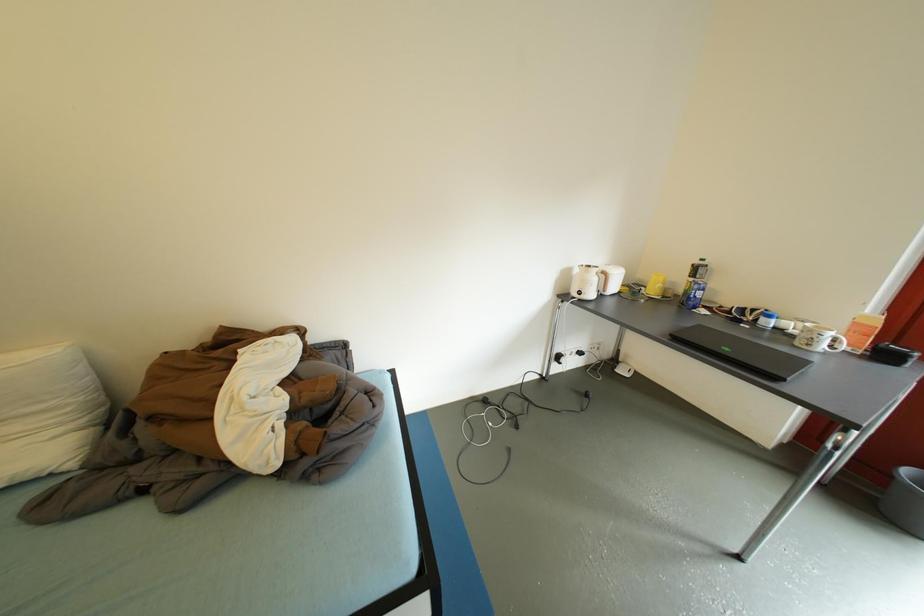
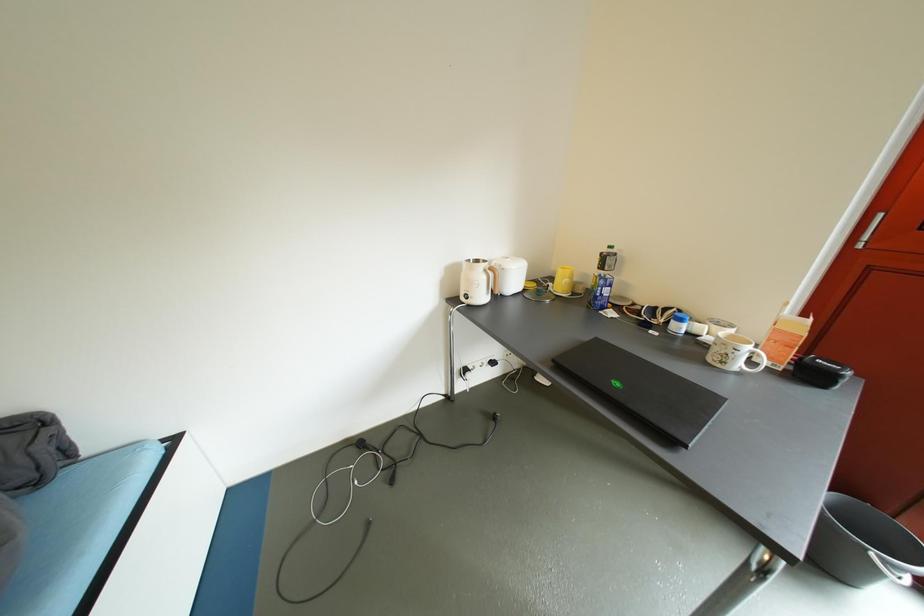
Which direction would the cameraman need to move to produce the second image?

The cameraman moved toward right, forward.